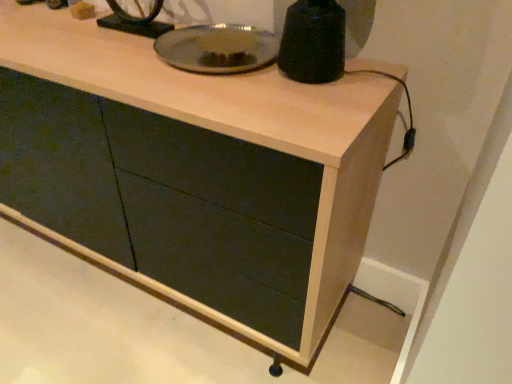
You are a GUI agent. You are given a task and a screenshot of the screen. Output one action in this format:
    pyautogui.click(x=<x>, y=<y>)
    Task: Click on the vacant point to the left of shiny glass plate at center
    
    Given the screenshot: What is the action you would take?
    pyautogui.click(x=115, y=56)